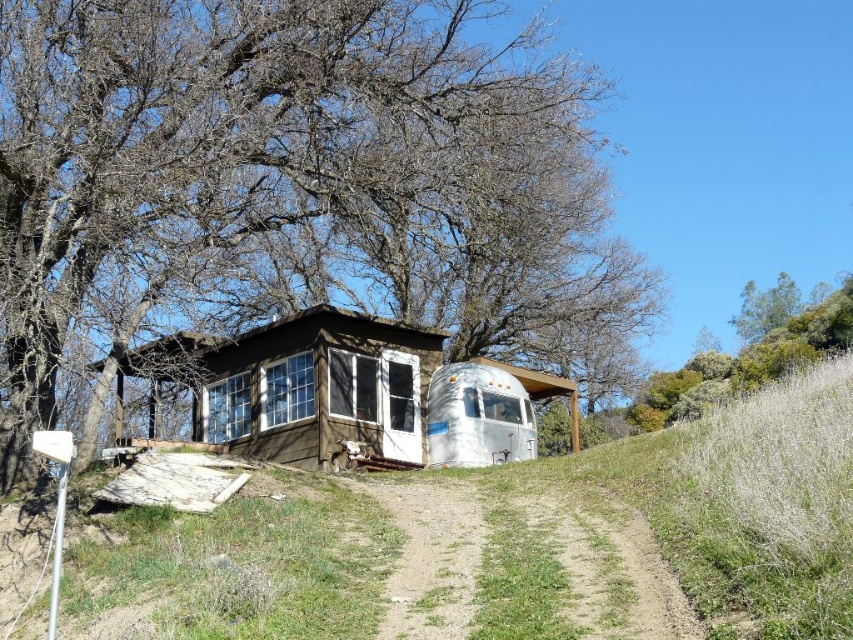
Question: Which of the following is the farthest from the observer?

Choices:
 (A) (430, 432)
 (B) (502, 170)

Answer: (A)

Question: Can you confirm if brown textured tree at upper left is bigger than dirt/grass at center?

Choices:
 (A) no
 (B) yes

Answer: (B)

Question: Is brown wood cabin at center to the right of silver metallic trailer at center from the viewer's perspective?

Choices:
 (A) no
 (B) yes

Answer: (A)

Question: Which point is closer to the camera?

Choices:
 (A) brown textured tree at upper left
 (B) brown wood cabin at center
 (C) dirt/grass at center
 (D) silver metallic trailer at center

Answer: (C)

Question: Based on their relative distances, which object is farther from the brown wood cabin at center?

Choices:
 (A) silver metallic trailer at center
 (B) brown textured tree at upper left

Answer: (B)

Question: In this image, where is brown textured tree at upper left located relative to dirt/grass at center?

Choices:
 (A) left
 (B) right

Answer: (A)